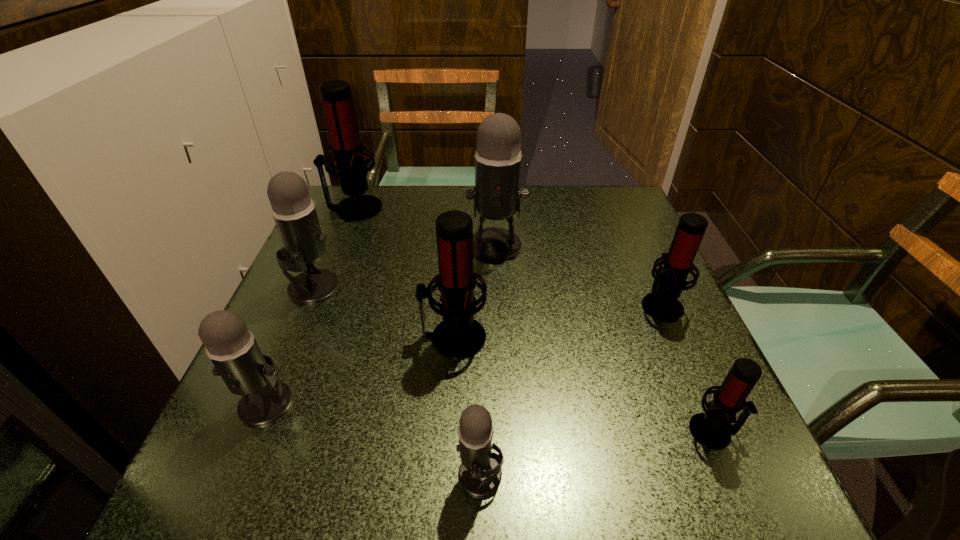
Image resolution: width=960 pixels, height=540 pixels. Find the location of `red microphone that stands as the second closest to the nearest object`. red microphone that stands as the second closest to the nearest object is located at coordinates (712, 429).

Identify the location of the third closest red microphone to the smallest red microphone. click(x=336, y=95).

Identify which gray microphone is the closest to the third smallest gray microphone. Please provide its 2D coordinates. Your answer should be formatted as a tuple, i.e. [(x, y)], where the tuple contains the x and y coordinates of a point satisfying the conditions above.

[(231, 346)]

Identify which gray microphone is the nearest to the smallest gray microphone. Please provide its 2D coordinates. Your answer should be formatted as a tuple, i.e. [(x, y)], where the tuple contains the x and y coordinates of a point satisfying the conditions above.

[(231, 346)]

At what (x,y) coordinates should I click in order to perform the action: click on free space that satisfies the following two spatial constraints: 1. on the back side of the farthest gray microphone; 2. on the left side of the nearest microphone. Please return your answer as a coordinate pair (x, y). Looking at the image, I should click on (480, 245).

This screenshot has width=960, height=540. Find the location of `vacant space that satisfies the following two spatial constraints: 1. on the back side of the third smallest red microphone; 2. on the left side of the biggest gray microphone`. vacant space that satisfies the following two spatial constraints: 1. on the back side of the third smallest red microphone; 2. on the left side of the biggest gray microphone is located at coordinates tap(459, 245).